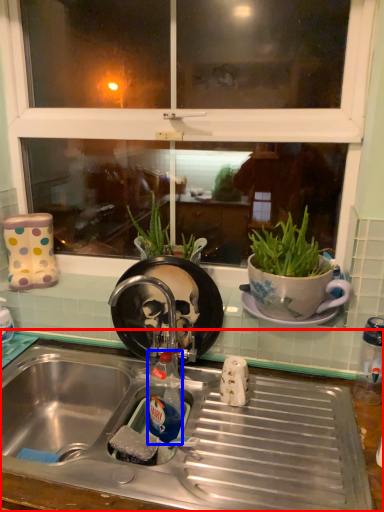
Question: Which object appears closest to the camera in this image, desk (highlighted by a red box) or bottle (highlighted by a blue box)?

Choices:
 (A) desk
 (B) bottle

Answer: (A)